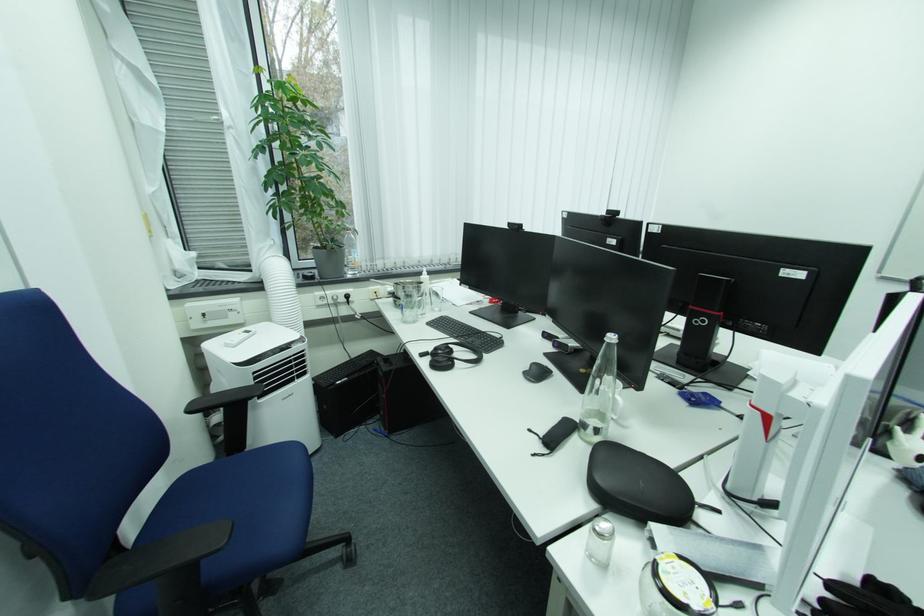
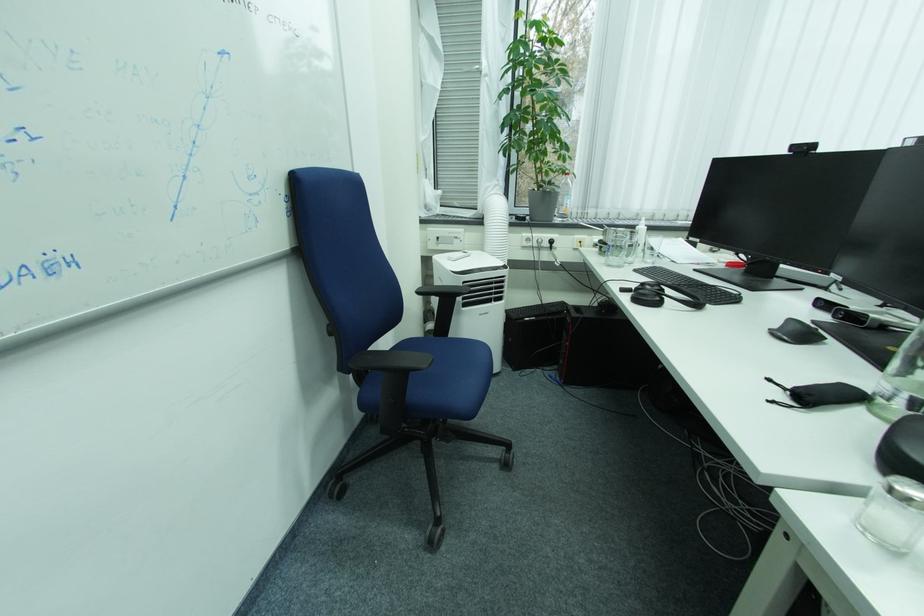
Where in the second image is the point corresponding to (x=565, y=339) from the first image?

(854, 309)